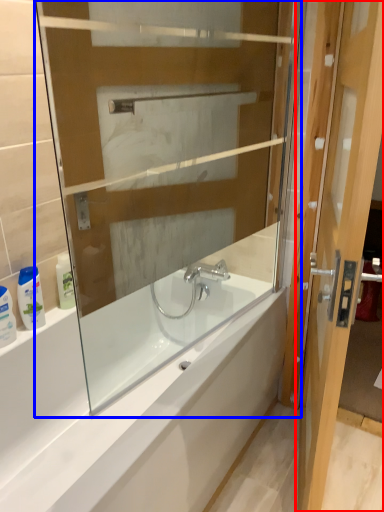
Question: Which point is further to the camera, door (highlighted by a red box) or glass box (highlighted by a blue box)?

Choices:
 (A) door
 (B) glass box

Answer: (B)